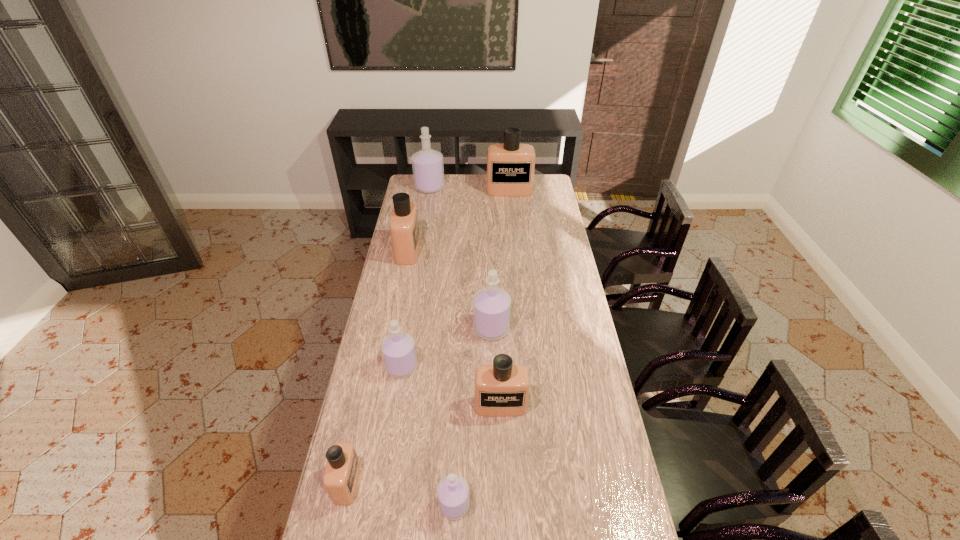
Locate an element on the screen. free spot between the nearest beige perfume and the third biggest purple perfume is located at coordinates (374, 424).

Locate an element on the screen. The height and width of the screenshot is (540, 960). vacant area between the second purple perfume from right to left and the rightmost purple perfume is located at coordinates (472, 416).

Locate an element on the screen. The image size is (960, 540). vacant area between the farthest purple perfume and the third smallest purple perfume is located at coordinates (461, 258).

Find the location of a particular element. The width and height of the screenshot is (960, 540). object that ranks as the seventh closest to the biggest beige perfume is located at coordinates (452, 491).

Select which object appears as the third closest to the third purple perfume from left to right. Please provide its 2D coordinates. Your answer should be formatted as a tuple, i.e. [(x, y)], where the tuple contains the x and y coordinates of a point satisfying the conditions above.

[(398, 350)]

Identify which perfume is the fourth closest to the farthest purple perfume. Please provide its 2D coordinates. Your answer should be formatted as a tuple, i.e. [(x, y)], where the tuple contains the x and y coordinates of a point satisfying the conditions above.

[(398, 350)]

The width and height of the screenshot is (960, 540). I want to click on perfume that is the closest to the biggest beige perfume, so click(x=427, y=164).

The image size is (960, 540). I want to click on purple perfume that is the third closest to the fourth nearest object, so click(x=427, y=164).

Locate an element on the screen. the closest purple perfume to the third biggest purple perfume is located at coordinates (491, 305).

Identify which beige perfume is the closest to the third farthest object. Please provide its 2D coordinates. Your answer should be formatted as a tuple, i.e. [(x, y)], where the tuple contains the x and y coordinates of a point satisfying the conditions above.

[(510, 166)]